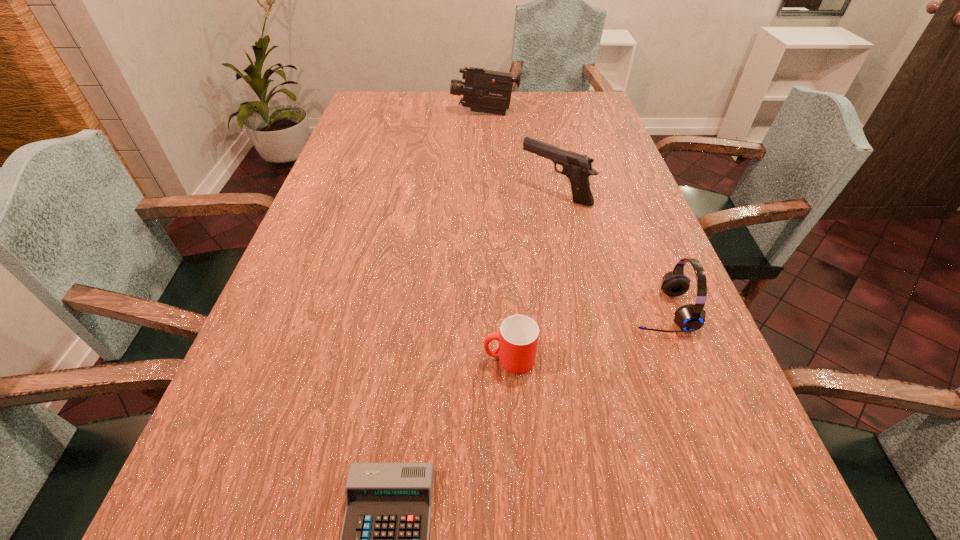
At what (x,y) coordinates should I click in order to perform the action: click on free spot between the farthest object and the cup. Please return your answer as a coordinate pair (x, y). This screenshot has width=960, height=540. Looking at the image, I should click on (497, 236).

Image resolution: width=960 pixels, height=540 pixels. In order to click on vacant space that's between the fourth tallest object and the second farthest object in this screenshot , I will do `click(532, 276)`.

Identify the location of free space between the camcorder and the third nearest object. This screenshot has width=960, height=540. (572, 212).

Image resolution: width=960 pixels, height=540 pixels. In order to click on object that stands as the closest to the cup in this screenshot , I will do `click(384, 539)`.

This screenshot has height=540, width=960. In order to click on object that is the second closest to the farthest object in this screenshot , I will do (x=691, y=317).

Where is `free space that satisfies the following two spatial constraints: 1. on the side of the cup with the handle; 2. on the front-facing side of the camcorder`? This screenshot has height=540, width=960. free space that satisfies the following two spatial constraints: 1. on the side of the cup with the handle; 2. on the front-facing side of the camcorder is located at coordinates (495, 114).